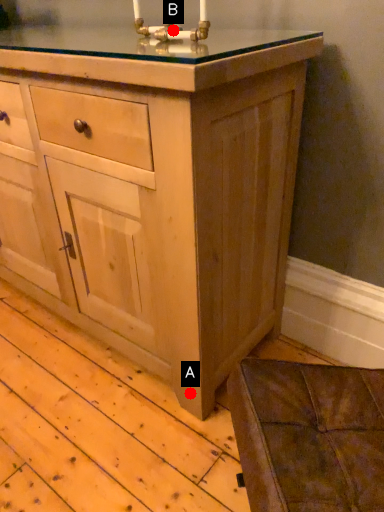
Question: Two points are circled on the image, labeled by A and B beside each circle. Among these points, which one is farthest from the camera?

Choices:
 (A) A is further
 (B) B is further

Answer: (A)